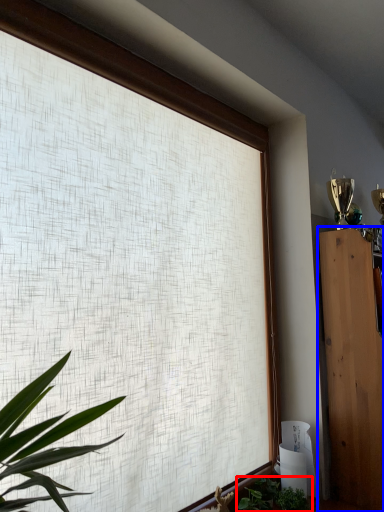
Question: Which object appears farthest to the camera in this image, houseplant (highlighted by a red box) or furniture (highlighted by a blue box)?

Choices:
 (A) houseplant
 (B) furniture

Answer: (A)